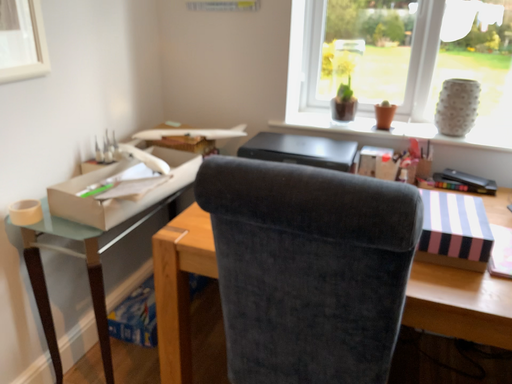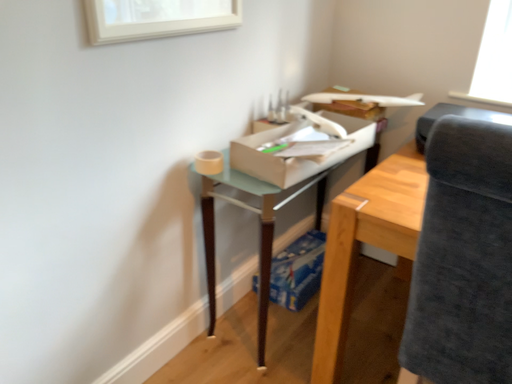
Question: Which way did the camera rotate in the video?

Choices:
 (A) rotated left
 (B) rotated right

Answer: (A)